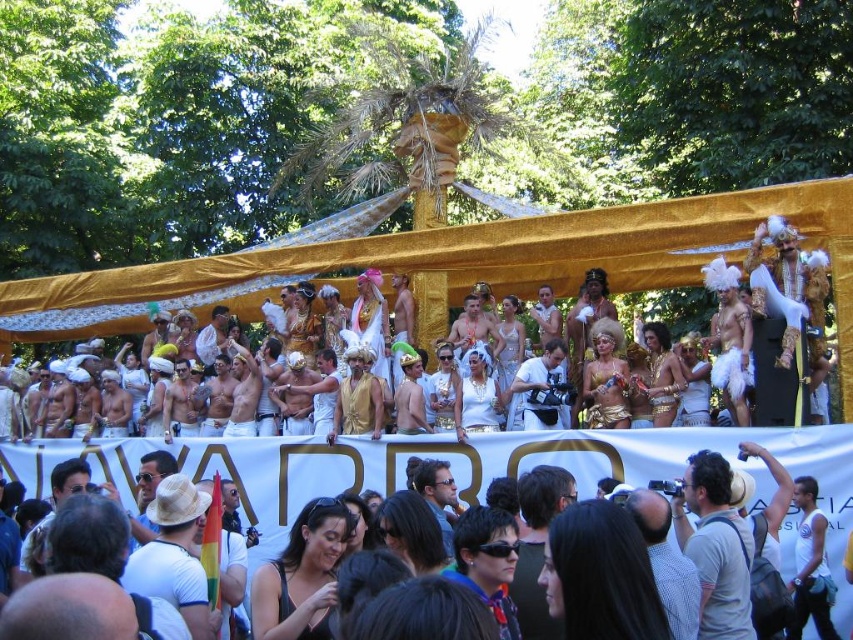
You are a photographer at the event and want to capture both the white cotton shirt at center and the golden fabric turban at center in a single frame. Which object should you focus on first to ensure both are in the frame?

The white cotton shirt at center is smaller than the golden fabric turban at center, so you should focus on the golden fabric turban at center first to ensure both fit within the frame.

You are a photographer at the event and want to take a photo of the golden canopy. You have a white matte camera at center and a smooth white cloth at center. Which object should you use to adjust the lighting before taking the photo?

You should use the smooth white cloth at center to adjust the lighting because it can reflect light onto the subject, whereas the white matte camera at center is the actual camera used for taking the photo.